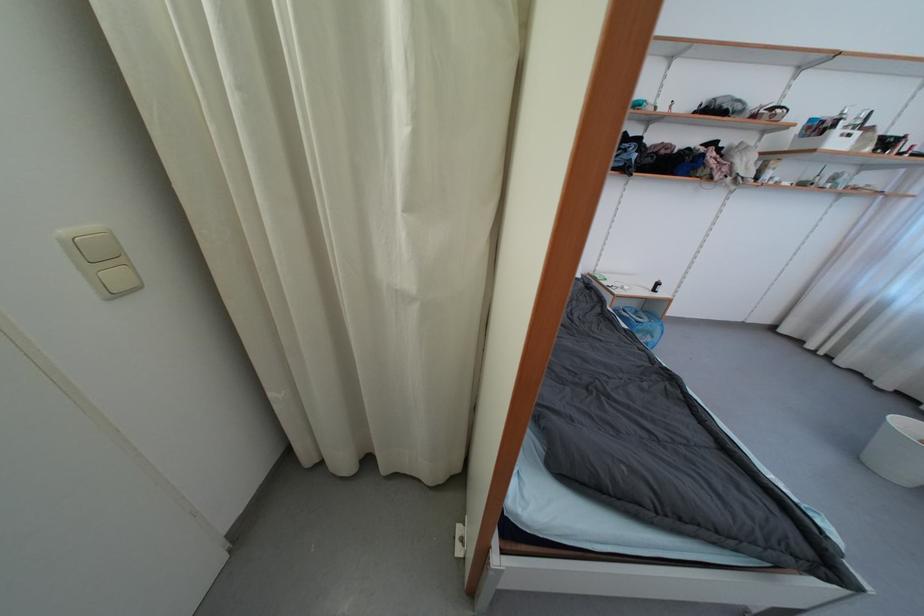
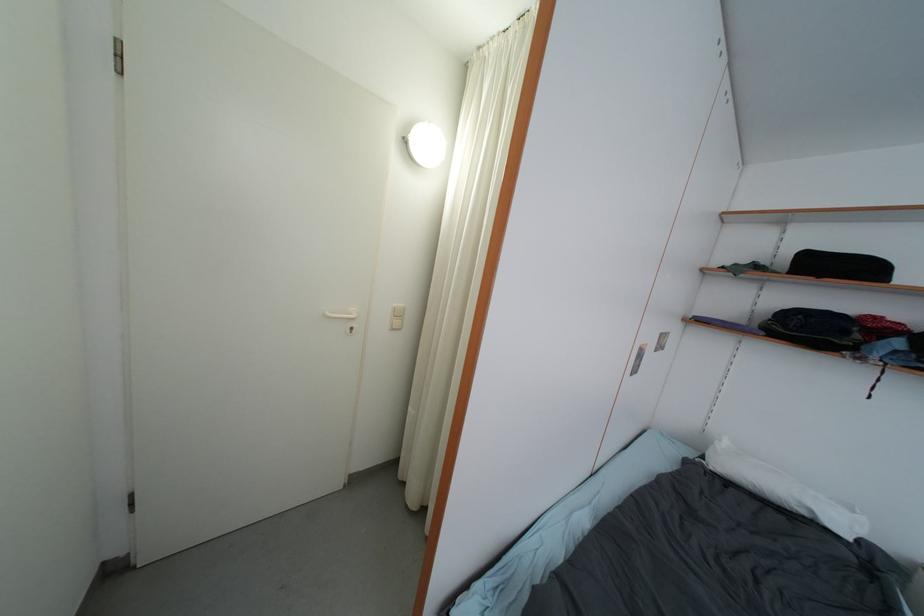
Question: The camera is either moving clockwise (left) or counter-clockwise (right) around the object. The first image is from the beginning of the video and the second image is from the end. Is the camera moving left or right when shooting the video?

Choices:
 (A) Left
 (B) Right

Answer: (B)